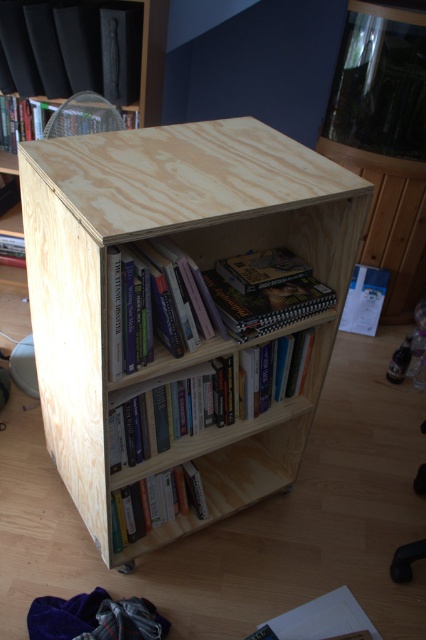
You are organizing books on the top shelf of the wooden bookshelf. You have two books there, the black matte book at upper left and the hardcover book at upper left. Which book is placed on top of the other?

The black matte book at upper left is positioned over the hardcover book at upper left, so it is placed on top.

Please provide the coordinates of the hardcover books at center in the image. The coordinate system is normalized such that the top left corner is at point 0,0 and the bottom right corner is at point 1,1. Please answer in the format of coordinates in parentheses.

The coordinates of the hardcover books at center are at point (192, 305).

Based on the photo, you are a delivery person holding a package that is 1 meter long. You need to place it on the shelf where the hardcover books at center are located. Can you fit the package on that shelf without tilting it?

The distance between the hardcover books at center and the camera is 1.01 meters, which indicates the depth of the shelf. Since the package is 1 meter long, it can fit on the shelf as the shelf depth is slightly more than the package length.